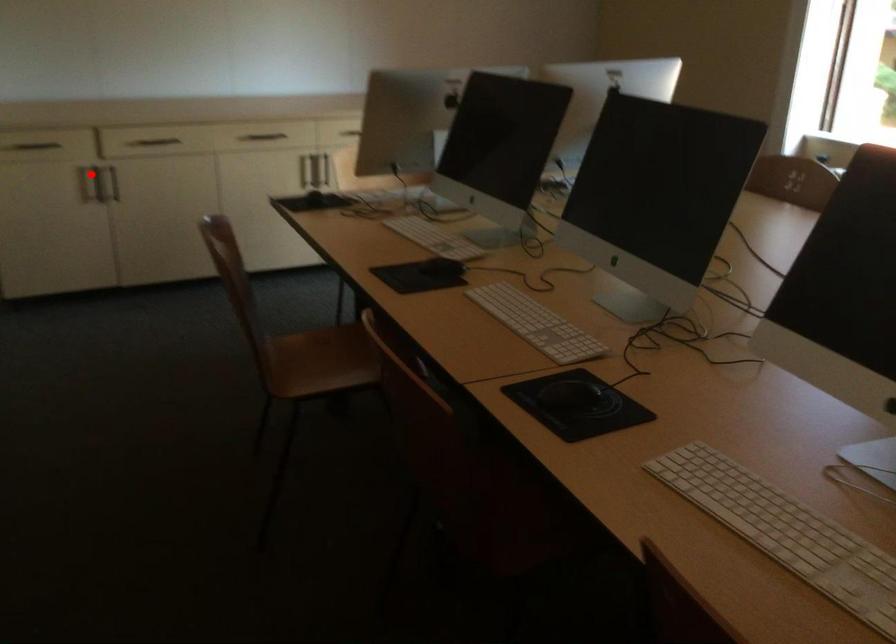
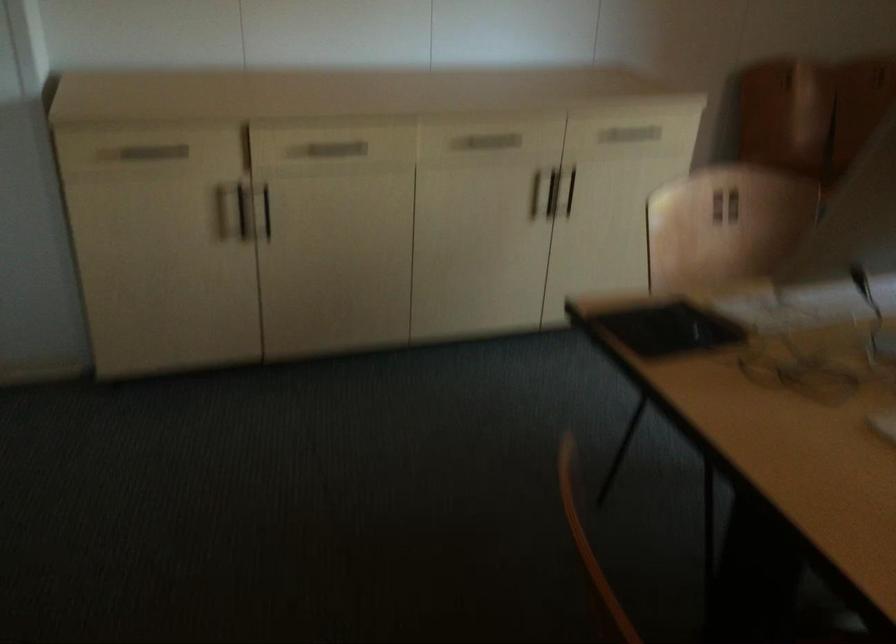
Where in the second image is the point corresponding to the highlighted location from the first image?

(243, 211)